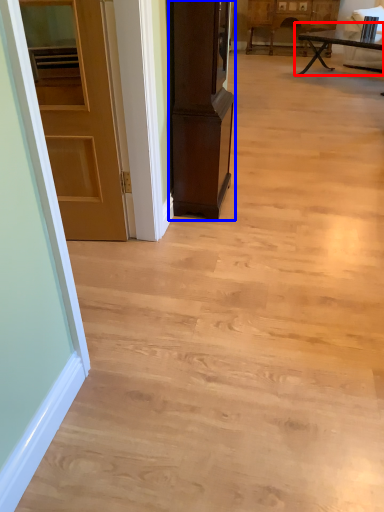
Question: Which object appears closest to the camera in this image, table (highlighted by a red box) or cabinetry (highlighted by a blue box)?

Choices:
 (A) table
 (B) cabinetry

Answer: (B)